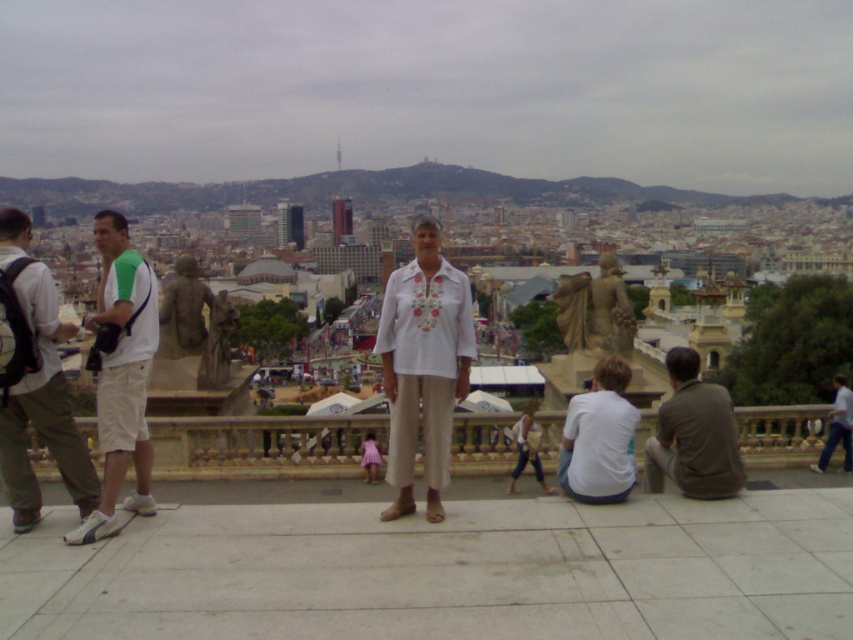
Question: Which object is closer to the camera taking this photo?

Choices:
 (A) green fabric shirt at left
 (B) purple satin dress at center

Answer: (A)

Question: From the image, what is the correct spatial relationship of white cotton shirt at lower right in relation to purple satin dress at center?

Choices:
 (A) above
 (B) below

Answer: (A)

Question: Which point is closer to the camera taking this photo?

Choices:
 (A) (569, 442)
 (B) (709, 458)
 (C) (364, 472)
 (D) (408, 481)

Answer: (B)

Question: Is white cotton shirt at lower right in front of purple satin dress at center?

Choices:
 (A) yes
 (B) no

Answer: (A)

Question: Can you confirm if white embroidered blouse at center is positioned above purple satin dress at center?

Choices:
 (A) no
 (B) yes

Answer: (B)

Question: Based on their relative distances, which object is nearer to the blue fabric shirt at lower right?

Choices:
 (A) green fabric shirt at left
 (B) white embroidered blouse at center
 (C) purple satin dress at center
 (D) white cotton shorts at left

Answer: (B)